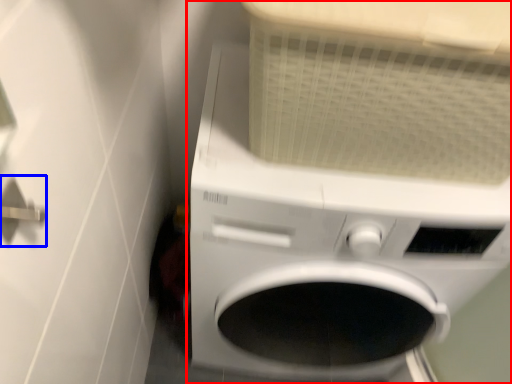
Question: Which object is further to the camera taking this photo, washing machine (highlighted by a red box) or door handle (highlighted by a blue box)?

Choices:
 (A) washing machine
 (B) door handle

Answer: (A)